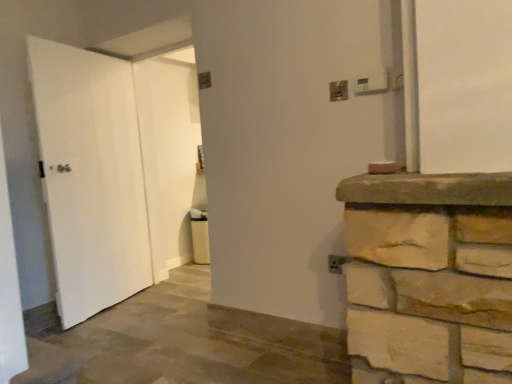
Question: Is point [183, 59] positioned closer to the camera than point [190, 198]?

Choices:
 (A) farther
 (B) closer

Answer: (B)

Question: Is white matte door at left, positioned as the 1th door in left-to-right order, inside or outside of white matte door at center, the 1th door positioned from the right?

Choices:
 (A) inside
 (B) outside

Answer: (B)

Question: Which object is the closest to the white matte door at center, the 1th door positioned from the right?

Choices:
 (A) white matte door at left, positioned as the 1th door in left-to-right order
 (B) metallic silver electric outlet at upper center, which is counted as the second electric outlet, starting from the right
 (C) metallic silver electric outlet at upper right, positioned as the first electric outlet in front-to-back order

Answer: (A)

Question: Which object is positioned farthest from the metallic silver electric outlet at upper center, which is counted as the second electric outlet, starting from the front?

Choices:
 (A) white matte door at center, the 1th door positioned from the right
 (B) metallic silver electric outlet at upper right, positioned as the first electric outlet in front-to-back order
 (C) white matte door at left, which is the 2th door from right to left

Answer: (A)